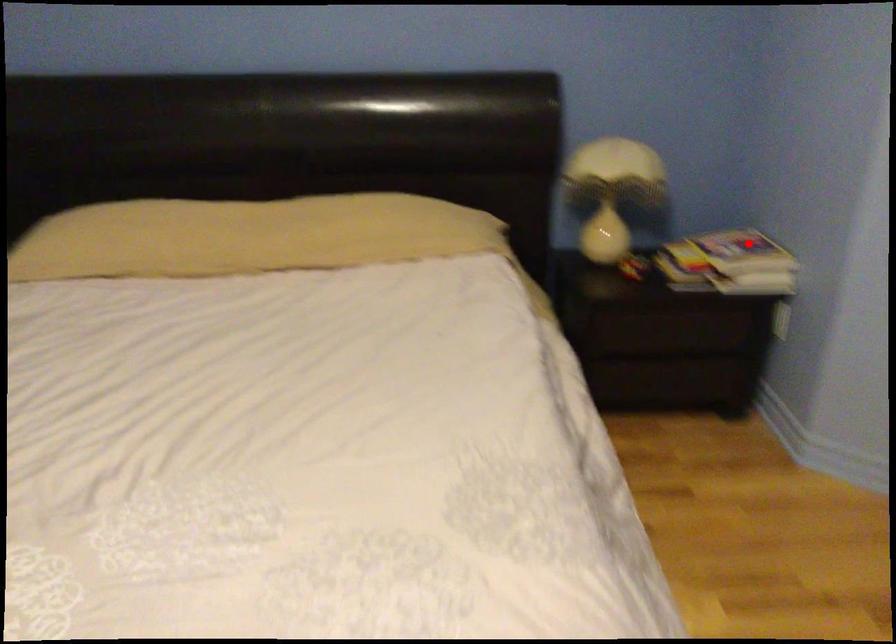
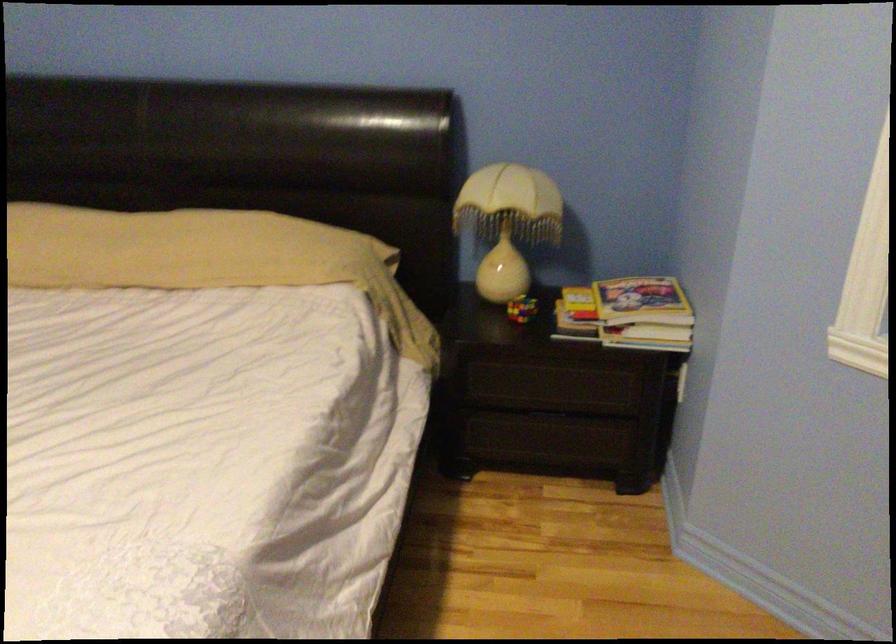
Question: I am providing you with two images of the same scene from different viewpoints. In image1, a red point is highlighted. Considering the same 3D point in image2, which of the following is correct?

Choices:
 (A) It is closer
 (B) It is farther

Answer: (A)